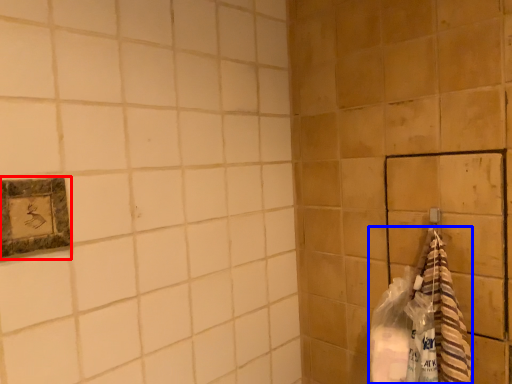
Question: Among these objects, which one is nearest to the camera, picture frame (highlighted by a red box) or material (highlighted by a blue box)?

Choices:
 (A) picture frame
 (B) material

Answer: (A)